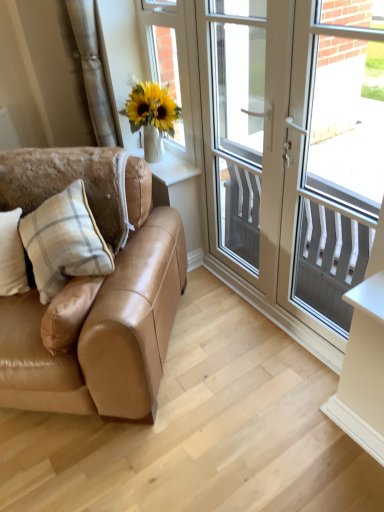
Question: Considering the relative sizes of white plaid pillow at left, the second pillow when ordered from right to left, and beige plaid pillow at left, positioned as the first pillow in right-to-left order, in the image provided, is white plaid pillow at left, the second pillow when ordered from right to left, bigger than beige plaid pillow at left, positioned as the first pillow in right-to-left order,?

Choices:
 (A) yes
 (B) no

Answer: (B)

Question: Is white plaid pillow at left, placed as the 1th pillow when sorted from left to right, looking in the opposite direction of beige plaid pillow at left, positioned as the first pillow in right-to-left order?

Choices:
 (A) yes
 (B) no

Answer: (B)

Question: Is white plaid pillow at left, the second pillow when ordered from right to left, in contact with beige plaid pillow at left, positioned as the first pillow in right-to-left order?

Choices:
 (A) yes
 (B) no

Answer: (B)

Question: Is white plaid pillow at left, placed as the 1th pillow when sorted from left to right, positioned before beige plaid pillow at left, positioned as the first pillow in right-to-left order?

Choices:
 (A) no
 (B) yes

Answer: (A)

Question: From the image's perspective, relative to white plastic door at center, is white plaid pillow at left, placed as the 1th pillow when sorted from left to right, above or below?

Choices:
 (A) below
 (B) above

Answer: (A)

Question: Does point (9, 285) appear closer or farther from the camera than point (317, 220)?

Choices:
 (A) farther
 (B) closer

Answer: (B)

Question: From their relative heights in the image, would you say white plaid pillow at left, the second pillow when ordered from right to left, is taller or shorter than white plastic door at center?

Choices:
 (A) short
 (B) tall

Answer: (A)

Question: Considering their positions, is white plaid pillow at left, placed as the 1th pillow when sorted from left to right, located in front of or behind white plastic door at center?

Choices:
 (A) behind
 (B) front

Answer: (A)

Question: In the image, is white textured screen at right, arranged as the 2th window screen when viewed from the left, on the left side or the right side of beige plaid pillow at left, the second pillow from the left?

Choices:
 (A) left
 (B) right

Answer: (B)

Question: From a real-world perspective, is white textured screen at right, the first window screen when ordered from right to left, above or below beige plaid pillow at left, the second pillow from the left?

Choices:
 (A) above
 (B) below

Answer: (A)

Question: Does point (367, 89) appear closer or farther from the camera than point (26, 232)?

Choices:
 (A) closer
 (B) farther

Answer: (B)

Question: From their relative heights in the image, would you say white textured screen at right, the first window screen when ordered from right to left, is taller or shorter than beige plaid pillow at left, positioned as the first pillow in right-to-left order?

Choices:
 (A) short
 (B) tall

Answer: (B)

Question: Is white glossy screen door at upper right inside or outside of white textured screen at right, the first window screen when ordered from right to left?

Choices:
 (A) outside
 (B) inside

Answer: (A)

Question: In the image, is white glossy screen door at upper right on the left side or the right side of white textured screen at right, arranged as the 2th window screen when viewed from the left?

Choices:
 (A) right
 (B) left

Answer: (B)